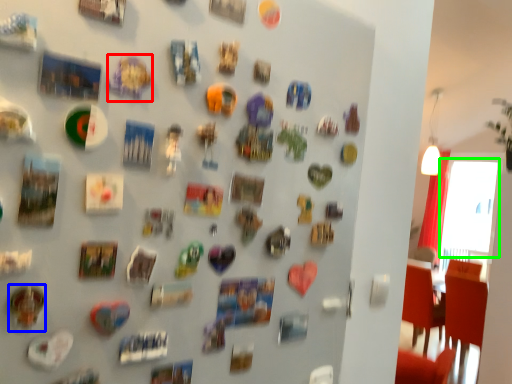
Question: Considering the real-world distances, which object is farthest from art (highlighted by a red box)? art (highlighted by a blue box) or window screen (highlighted by a green box)?

Choices:
 (A) art
 (B) window screen

Answer: (B)